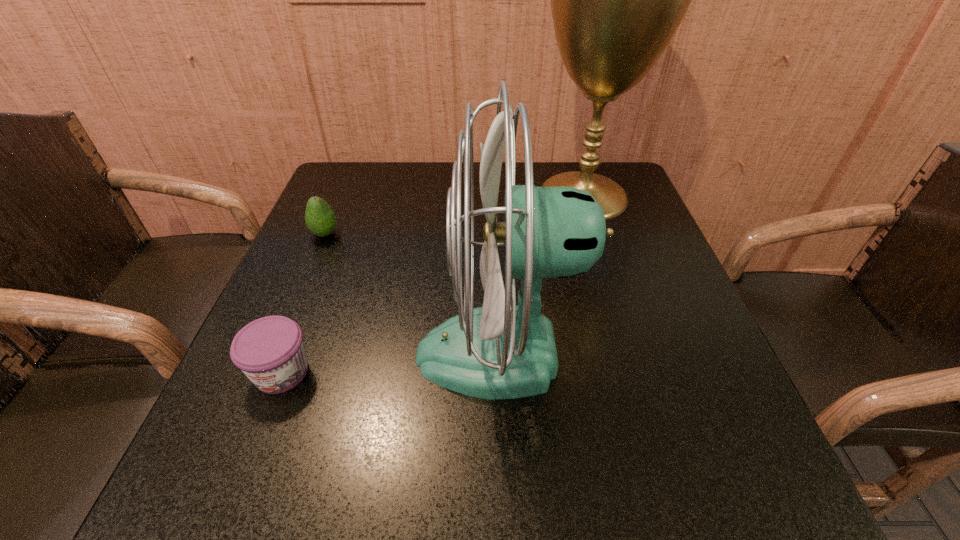
Locate an element on the screen. The width and height of the screenshot is (960, 540). the tallest object is located at coordinates (617, 0).

The height and width of the screenshot is (540, 960). Find the location of `fan`. fan is located at coordinates (501, 350).

Find the location of a particular element. This screenshot has height=540, width=960. avocado is located at coordinates (320, 218).

Find the location of a particular element. Image resolution: width=960 pixels, height=540 pixels. the shortest object is located at coordinates (270, 351).

Find the location of a particular element. This screenshot has height=540, width=960. blank area located on the left of the trophy cup is located at coordinates (507, 195).

Where is `vacant region located in front of the fan, directing airflow`? vacant region located in front of the fan, directing airflow is located at coordinates pyautogui.click(x=274, y=355).

Locate an element on the screen. The width and height of the screenshot is (960, 540). vacant space located 0.170m in front of the fan, directing airflow is located at coordinates (320, 355).

Where is `vacant region located 0.200m in front of the fan, directing airflow`? The height and width of the screenshot is (540, 960). vacant region located 0.200m in front of the fan, directing airflow is located at coordinates (302, 355).

You are a GUI agent. You are given a task and a screenshot of the screen. Output one action in this format:
    pyautogui.click(x=<x>, y=<y>)
    Task: Click on the free region located 0.210m on the front of the avocado
    The image size is (960, 540).
    Given the screenshot: What is the action you would take?
    pyautogui.click(x=293, y=311)

Find the location of a particular element. free space located on the front label of the shortest object is located at coordinates (244, 469).